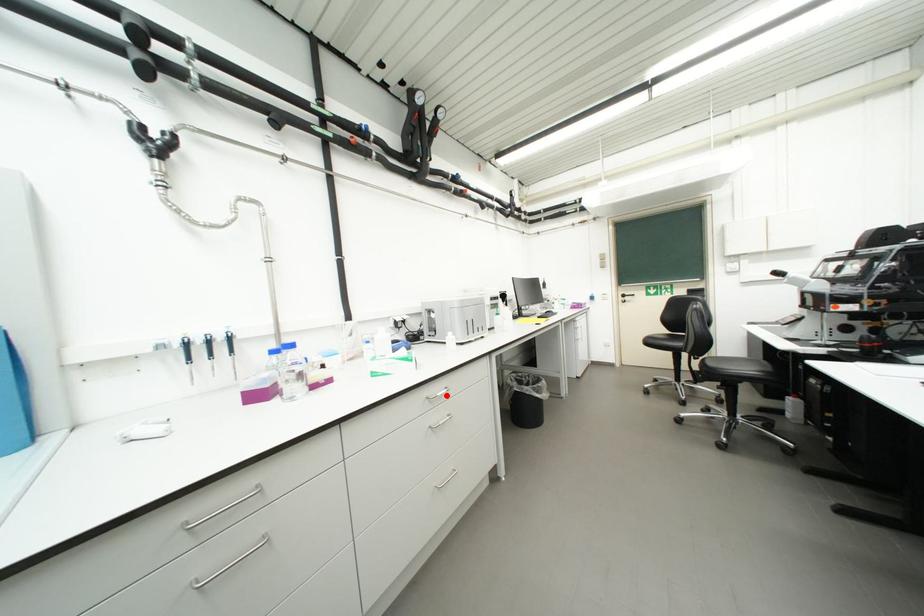
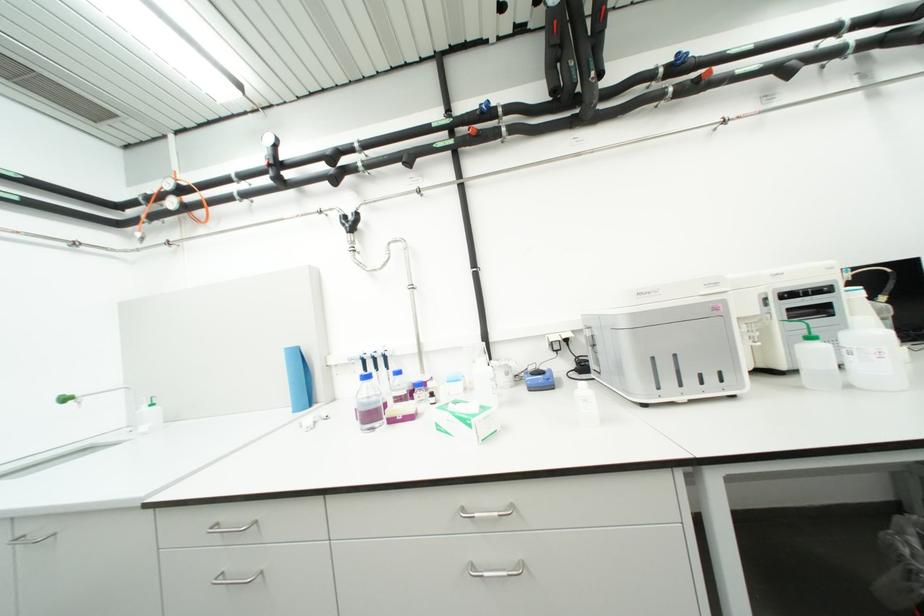
Find the pixel in the second image that matches the highlighted location in the first image.

(484, 516)